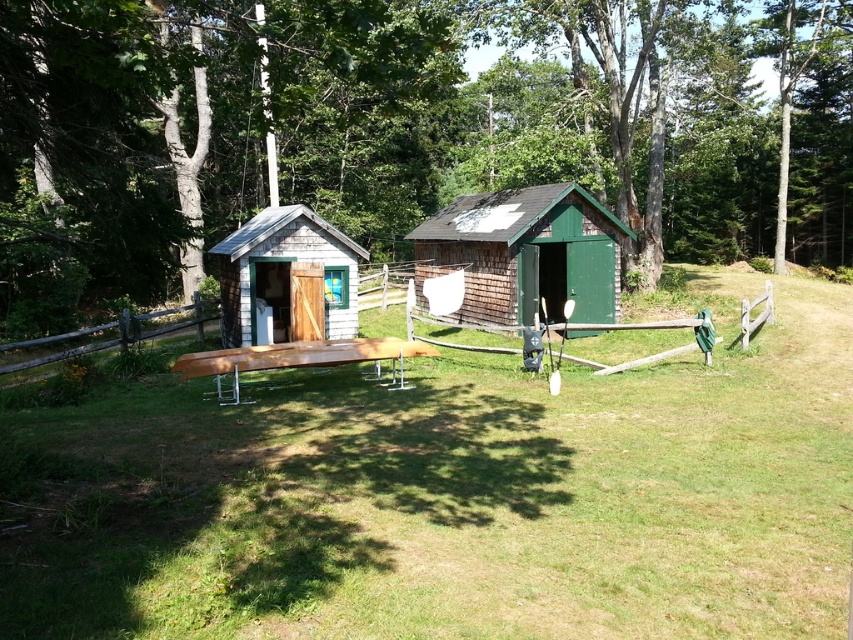
Question: Which of these objects is positioned closest to the green shingled cabin at center?

Choices:
 (A) wooden at center
 (B) gray shingled shed at center

Answer: (B)

Question: Can you confirm if green shingled cabin at center is positioned to the left of gray shingled shed at center?

Choices:
 (A) yes
 (B) no

Answer: (B)

Question: Which object is positioned farthest from the green shingled cabin at center?

Choices:
 (A) light brown wood picnic table at center
 (B) gray shingled shed at center

Answer: (A)

Question: Which point is farther to the camera?

Choices:
 (A) (189, 371)
 (B) (567, 300)

Answer: (B)

Question: Is green wood tree at upper center closer to camera compared to wooden at center?

Choices:
 (A) no
 (B) yes

Answer: (B)

Question: Is green wood tree at upper center positioned in front of wooden at center?

Choices:
 (A) yes
 (B) no

Answer: (A)